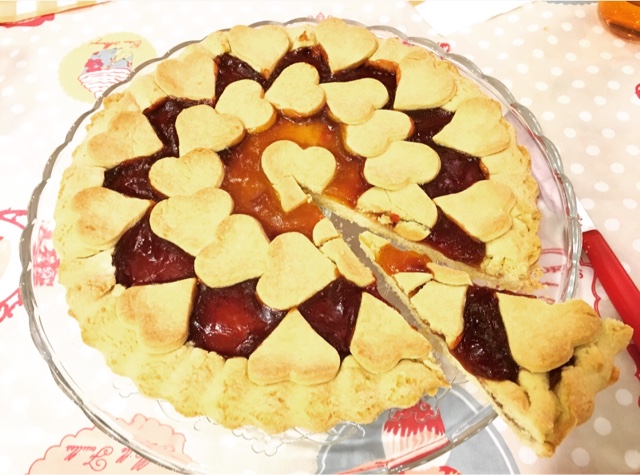
The width and height of the screenshot is (640, 475). I want to click on 1 polka dot surface, so click(593, 99).